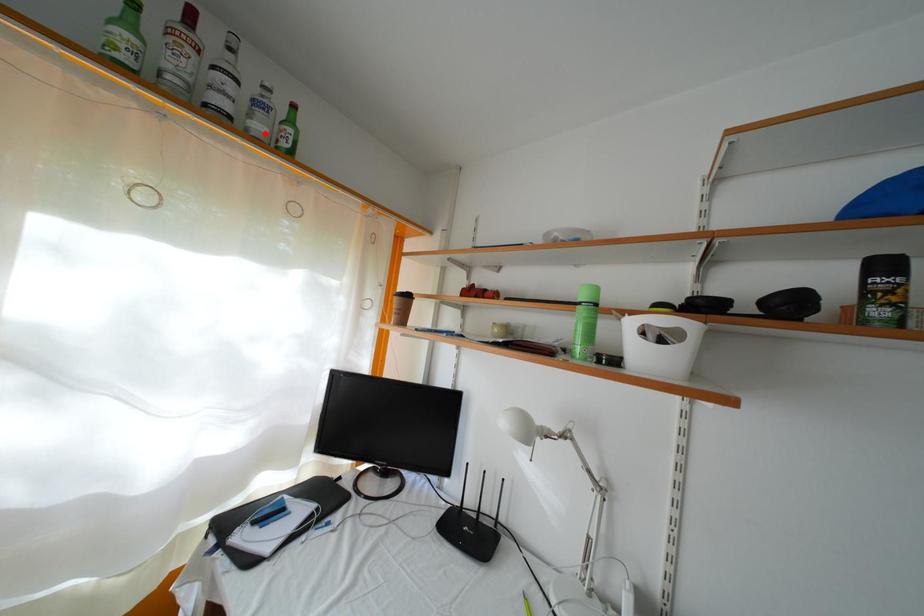
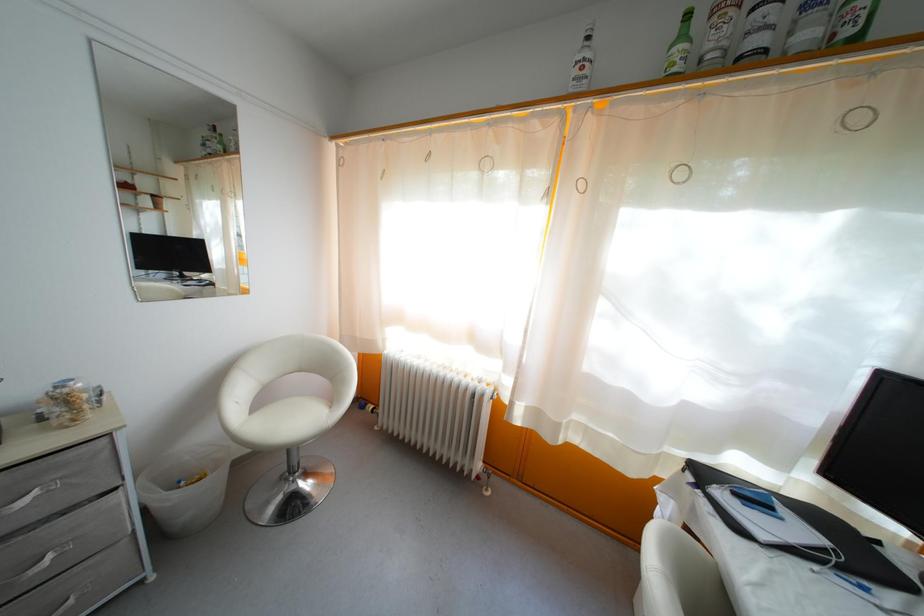
The point at the highlighted location is marked in the first image. Where is the corresponding point in the second image?

(812, 42)